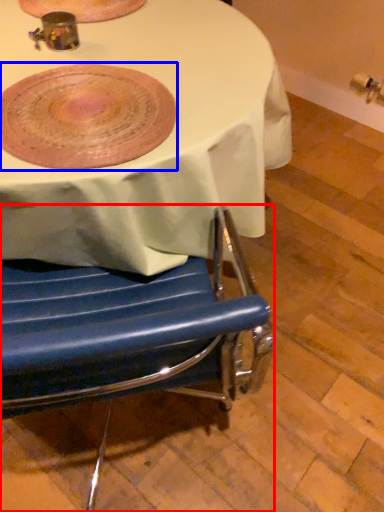
Question: Which object is further to the camera taking this photo, chair (highlighted by a red box) or platter (highlighted by a blue box)?

Choices:
 (A) chair
 (B) platter

Answer: (A)